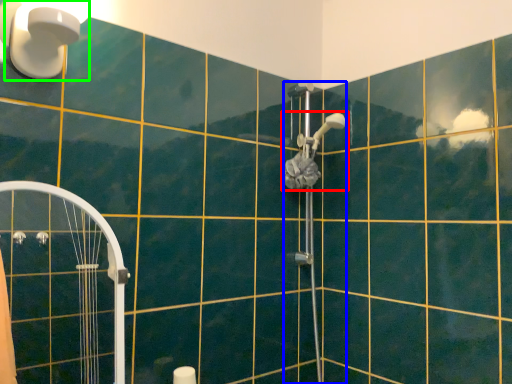
Question: Which object is the closest to the shower (highlighted by a red box)? Choose among these: shower (highlighted by a blue box) or light fixture (highlighted by a green box).

Choices:
 (A) shower
 (B) light fixture

Answer: (A)